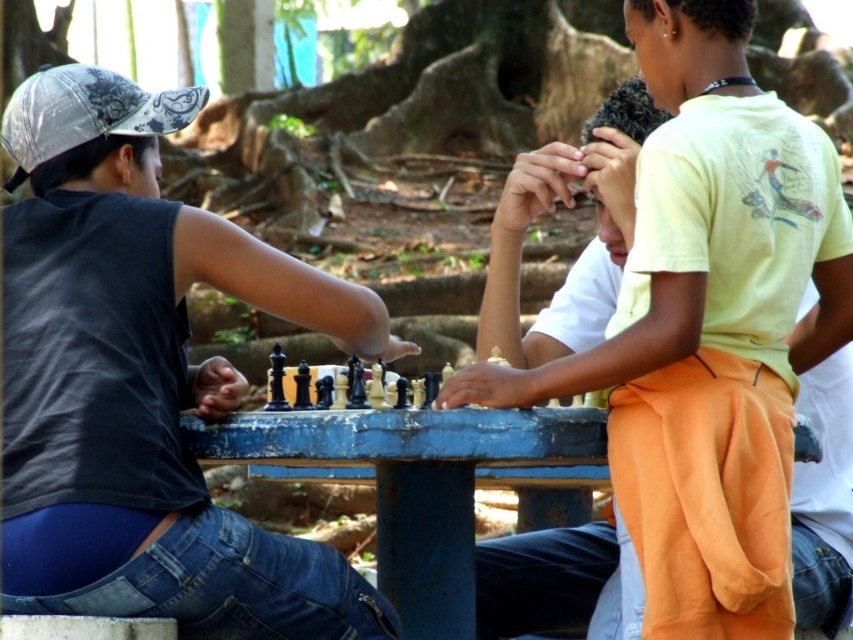
Which object is located at point (144, 381)?

The matte black chess set at center is located at point (144, 381).